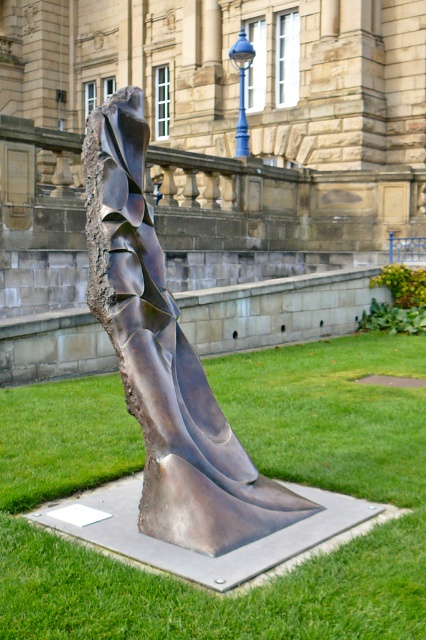
You are a gardener who needs to water the green grass at center. The watering hose can reach up to 4 feet. Can you water the bronze sculpture at center from your current position without moving the hose?

The distance between the green grass at center and bronze sculpture at center is 3.88 feet, which is within the 4 feet reach of the hose. Therefore, you can water the bronze sculpture at center without moving the hose.

You are standing in front of the sculpture and want to place a small flag on the green grass at center. Can you place the flag directly in front of the bronze sculpture at center without it being blocked by the grass?

The green grass at center is closer to the viewer than the bronze sculpture at center, so placing the flag directly in front of the bronze sculpture at center would place it behind the grass, making it blocked.

You are standing in front of the sculpture and want to place a small flag exactly at the center of the green grass at center. According to the coordinates provided, where should you place the flag?

The green grass at center is located at point coordinates (259, 468), so you should place the flag there.